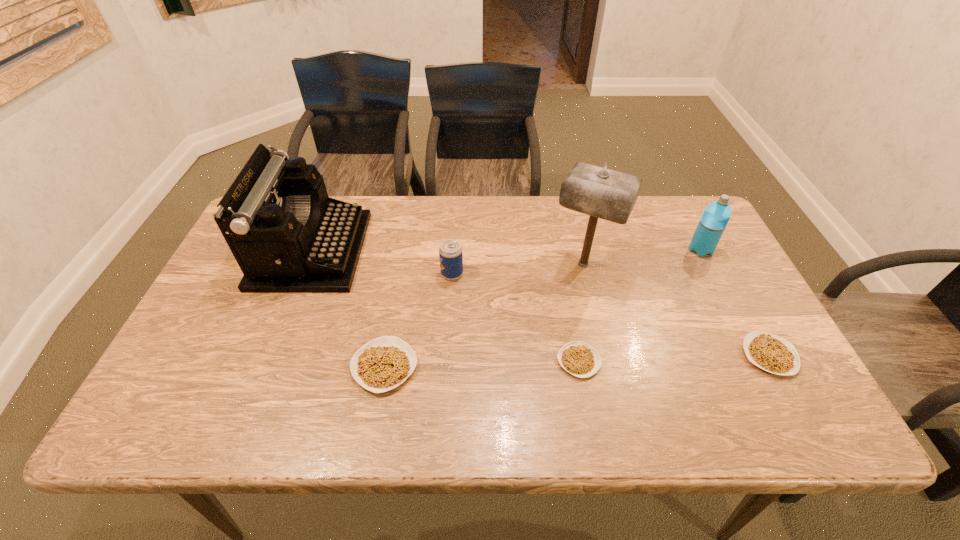
The image size is (960, 540). What are the coordinates of `thermos bottle present at the far edge` in the screenshot? It's located at (716, 215).

The height and width of the screenshot is (540, 960). Find the location of `object located in the left edge section of the desktop`. object located in the left edge section of the desktop is located at coordinates (287, 235).

Where is `legume that is positioned at the right edge`? The width and height of the screenshot is (960, 540). legume that is positioned at the right edge is located at coordinates click(x=769, y=352).

Identify the location of thermos bottle that is at the right edge. (716, 215).

In order to click on object situated at the far left corner in this screenshot , I will do `click(287, 235)`.

Where is `object present at the far right corner`? The image size is (960, 540). object present at the far right corner is located at coordinates (716, 215).

Where is `object at the near right corner`? object at the near right corner is located at coordinates (769, 352).

At what (x,y) coordinates should I click in order to perform the action: click on vacant space at the far edge of the desktop. Please return your answer as a coordinate pair (x, y). Looking at the image, I should click on (392, 212).

The width and height of the screenshot is (960, 540). What are the coordinates of `free space at the near edge of the desktop` in the screenshot? It's located at (655, 386).

Image resolution: width=960 pixels, height=540 pixels. In the image, there is a desktop. Find the location of `free space at the right edge`. free space at the right edge is located at coordinates (685, 249).